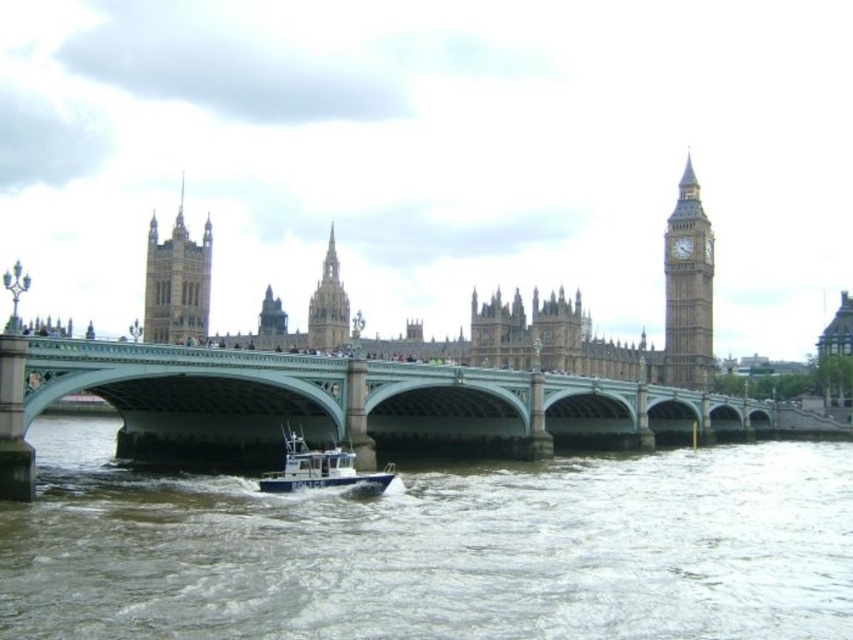
Does brown water at lower center have a greater width compared to white plastic boat at center?

Correct, the width of brown water at lower center exceeds that of white plastic boat at center.

Between brown water at lower center and white plastic boat at center, which one appears on the left side from the viewer's perspective?

white plastic boat at center is more to the left.

Which is behind, point (506, 502) or point (322, 472)?

The point (506, 502) is more distant.

This screenshot has height=640, width=853. In order to click on brown water at lower center in this screenshot , I will do `click(434, 548)`.

Which is more to the right, brown stone clock tower at right or golden stone tower at upper left?

brown stone clock tower at right is more to the right.

Between brown stone clock tower at right and golden stone tower at upper left, which one is positioned lower?

golden stone tower at upper left

Where is `brown stone clock tower at right`? brown stone clock tower at right is located at coordinates (688, 289).

Identify the location of brown stone clock tower at right. (688, 289).

Between green stone bridge at center and brown stone clock tower at right, which one has less height?

green stone bridge at center is shorter.

I want to click on green stone bridge at center, so click(x=352, y=406).

This screenshot has height=640, width=853. In order to click on green stone bridge at center in this screenshot , I will do `click(352, 406)`.

I want to click on green stone bridge at center, so click(352, 406).